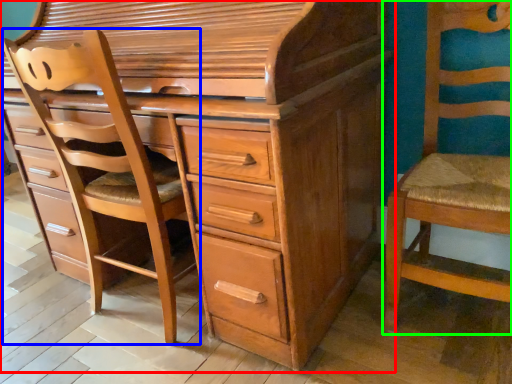
Question: Which object is the farthest from chest of drawers (highlighted by a red box)? Choose among these: armchair (highlighted by a blue box) or chair (highlighted by a green box).

Choices:
 (A) armchair
 (B) chair

Answer: (B)